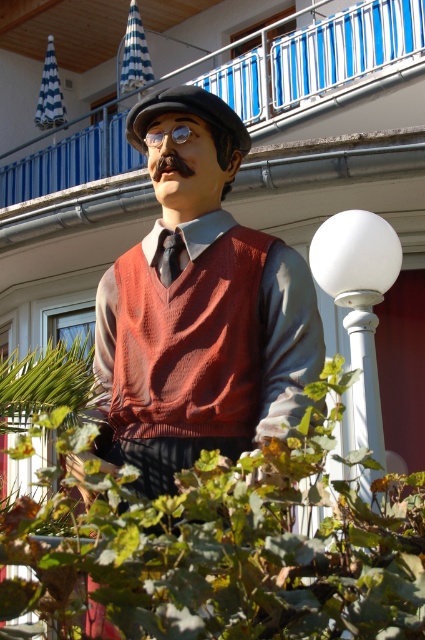
Question: Can you confirm if matte brown vest at center is positioned above black silk tie at center?

Choices:
 (A) yes
 (B) no

Answer: (B)

Question: Which of the following is the closest to the observer?

Choices:
 (A) (246, 417)
 (B) (173, 240)

Answer: (A)

Question: Among these objects, which one is farthest from the camera?

Choices:
 (A) matte brown vest at center
 (B) black silk tie at center

Answer: (B)

Question: Observing the image, what is the correct spatial positioning of matte brown vest at center in reference to black silk tie at center?

Choices:
 (A) above
 (B) below

Answer: (B)

Question: Does matte brown vest at center appear under black silk tie at center?

Choices:
 (A) yes
 (B) no

Answer: (A)